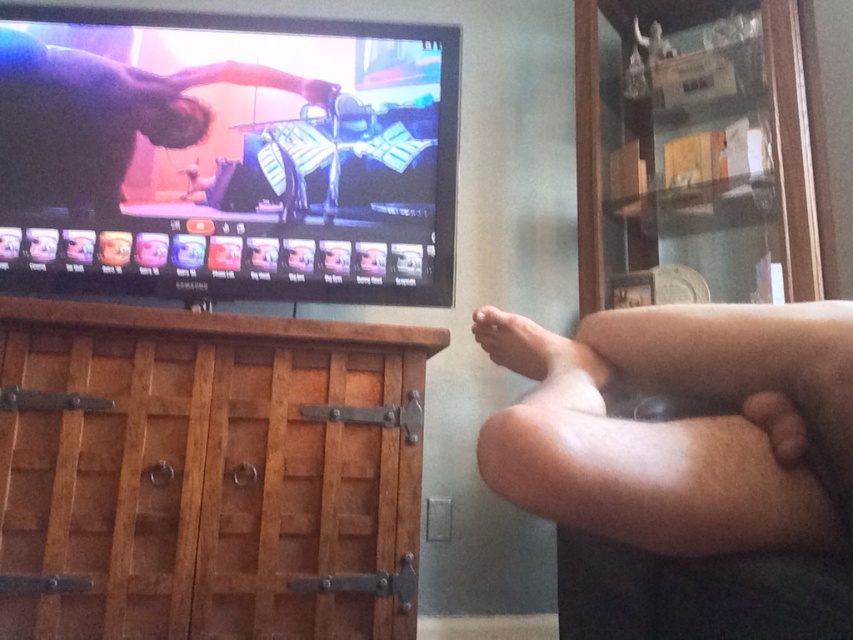
Does brown wood cabinet at left lie in front of pale skin foot at lower right?

No.

Which is in front, point (236, 595) or point (548, 342)?

Positioned in front is point (548, 342).

Does point (347, 544) come closer to viewer compared to point (494, 332)?

No, (347, 544) is behind (494, 332).

The height and width of the screenshot is (640, 853). Identify the location of brown wood cabinet at left. (209, 472).

Which is behind, point (62, 164) or point (503, 358)?

The point (62, 164) is more distant.

Is point (229, 80) positioned before point (543, 376)?

No, (229, 80) is further to viewer.

Image resolution: width=853 pixels, height=640 pixels. What are the coordinates of `smooth skin at center` in the screenshot? It's located at (102, 116).

Who is positioned more to the right, skinny flesh at lower right or pale skin foot at lower right?

skinny flesh at lower right

Does skinny flesh at lower right have a greater height compared to pale skin foot at lower right?

Yes, skinny flesh at lower right is taller than pale skin foot at lower right.

Does point (500, 355) lie behind point (492, 349)?

That is False.

Where is `skinny flesh at lower right`? The width and height of the screenshot is (853, 640). skinny flesh at lower right is located at coordinates (660, 426).